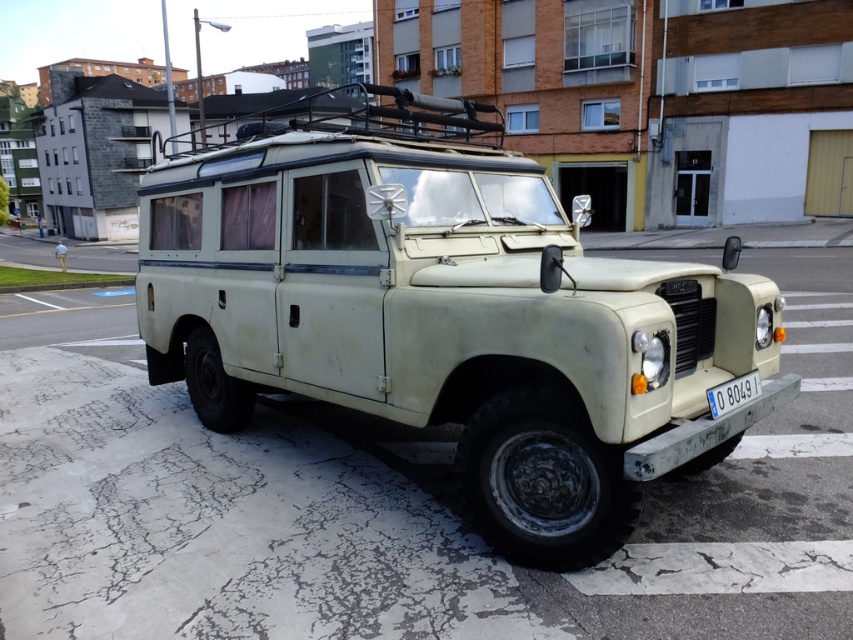
Question: Which object appears farthest from the camera in this image?

Choices:
 (A) white plastic license plate at lower center
 (B) matte cream jeep at center

Answer: (A)

Question: Is matte cream jeep at center to the left of white plastic license plate at lower center from the viewer's perspective?

Choices:
 (A) yes
 (B) no

Answer: (A)

Question: Is matte cream jeep at center positioned in front of white plastic license plate at lower center?

Choices:
 (A) no
 (B) yes

Answer: (B)

Question: Which object appears farthest from the camera in this image?

Choices:
 (A) white plastic license plate at lower center
 (B) matte cream jeep at center

Answer: (A)

Question: Is matte cream jeep at center to the left of white plastic license plate at lower center from the viewer's perspective?

Choices:
 (A) no
 (B) yes

Answer: (B)